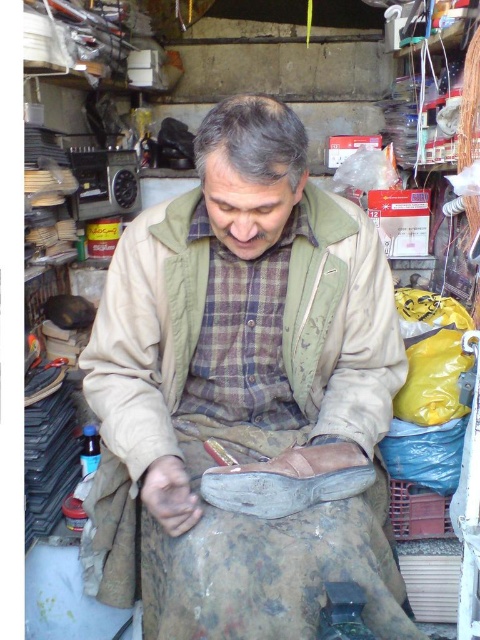
You are a customer entering the repair shop and see the beige fabric jacket at center and the brown leather shoe at lower center. Which item is positioned higher up in the scene?

The beige fabric jacket at center is located above the brown leather shoe at lower center, so it is positioned higher up in the scene.

What is the exact position of the beige fabric jacket at center in the image?

The beige fabric jacket at center is located at point (145, 339).

You are a delivery person who needs to hand a package to the man in the beige fabric jacket at center. The package is 1.2 meters long. Can you reach him without moving any objects in the scene?

The beige fabric jacket at center is 1.08 meters away from the camera, so the delivery person can reach him with a 1.2 meter package since the package is longer than the distance required.